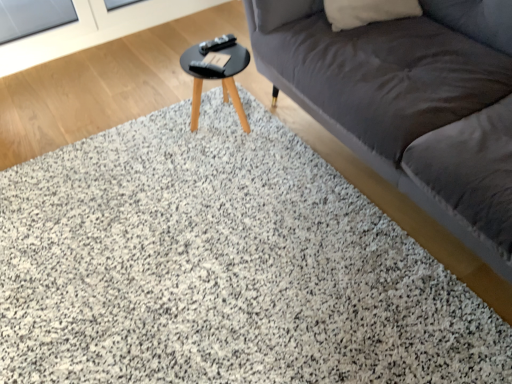
You are a GUI agent. You are given a task and a screenshot of the screen. Output one action in this format:
    pyautogui.click(x=<x>, y=<y>)
    Task: Click on the vacant space that is to the left of black glossy table at center
    The width and height of the screenshot is (512, 384).
    Given the screenshot: What is the action you would take?
    click(159, 144)